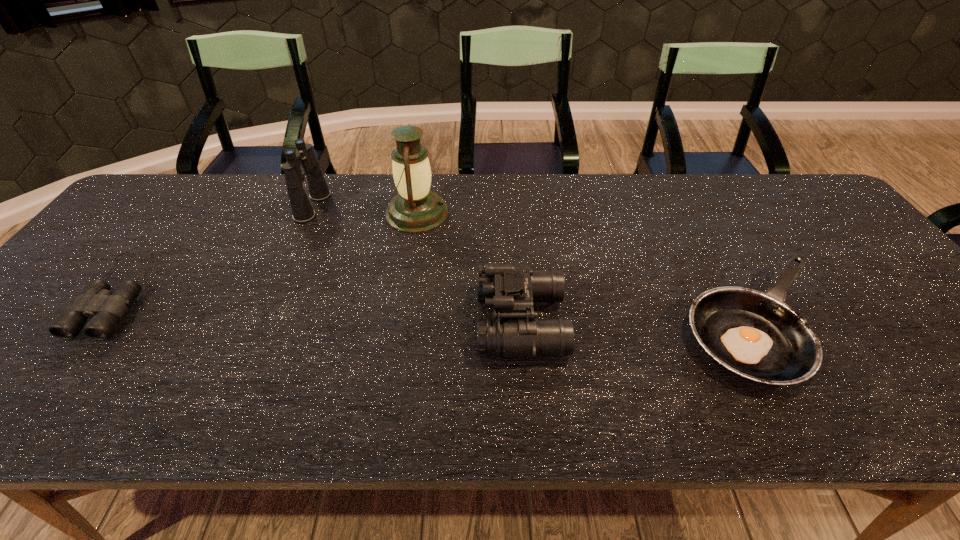
In order to click on binoculars that can be found as the third closest to the frying pan in this screenshot , I will do `click(96, 301)`.

Where is `vacant position in the image that satisfies the following two spatial constraints: 1. on the front side of the fourth object from right to left; 2. on the left side of the rightmost object`? vacant position in the image that satisfies the following two spatial constraints: 1. on the front side of the fourth object from right to left; 2. on the left side of the rightmost object is located at coordinates (262, 324).

At what (x,y) coordinates should I click in order to perform the action: click on free space in the image that satisfies the following two spatial constraints: 1. with the light compartment facing forward on the third object from right to left; 2. on the left side of the frying pan. Please return your answer as a coordinate pair (x, y). The height and width of the screenshot is (540, 960). Looking at the image, I should click on (399, 324).

The width and height of the screenshot is (960, 540). What are the coordinates of `vacant position in the image that satisfies the following two spatial constraints: 1. on the back side of the frying pan; 2. with the light compartment facing forward on the third object from right to left` in the screenshot? It's located at (695, 213).

Locate an element on the screen. vacant area in the image that satisfies the following two spatial constraints: 1. with the light compartment facing forward on the third object from right to left; 2. on the back side of the frying pan is located at coordinates (399, 324).

The height and width of the screenshot is (540, 960). In order to click on free space in the image that satisfies the following two spatial constraints: 1. at the eyepiece of the rightmost object; 2. on the right side of the leftmost object in this screenshot , I will do click(x=96, y=324).